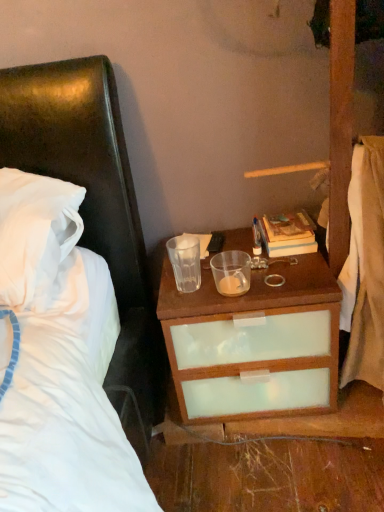
Question: Should I look upward or downward to see white cotton sheet at right?

Choices:
 (A) up
 (B) down

Answer: (A)